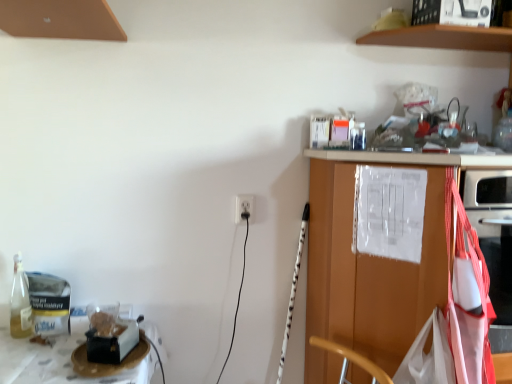
Question: Does wooden cabinet at right have a greater width compared to white plastic electric outlet at center?

Choices:
 (A) yes
 (B) no

Answer: (A)

Question: Can you confirm if wooden cabinet at right is shorter than white plastic electric outlet at center?

Choices:
 (A) yes
 (B) no

Answer: (B)

Question: Is wooden cabinet at right aimed at white plastic electric outlet at center?

Choices:
 (A) no
 (B) yes

Answer: (A)

Question: Can you confirm if wooden cabinet at right is smaller than white plastic electric outlet at center?

Choices:
 (A) yes
 (B) no

Answer: (B)

Question: Can you confirm if wooden cabinet at right is positioned to the left of white plastic electric outlet at center?

Choices:
 (A) no
 (B) yes

Answer: (A)

Question: Would you say wooden cabinet at right is inside or outside white plastic electric outlet at center?

Choices:
 (A) outside
 (B) inside

Answer: (A)

Question: Is wooden cabinet at right in front of or behind white plastic electric outlet at center in the image?

Choices:
 (A) behind
 (B) front

Answer: (B)

Question: Does point (508, 157) appear closer or farther from the camera than point (242, 218)?

Choices:
 (A) closer
 (B) farther

Answer: (A)

Question: In terms of size, does wooden cabinet at right appear bigger or smaller than white plastic electric outlet at center?

Choices:
 (A) small
 (B) big

Answer: (B)

Question: From a real-world perspective, relative to white plastic electric outlet at center, is brown wooden shelf at upper center vertically above or below?

Choices:
 (A) below
 (B) above

Answer: (B)

Question: Is brown wooden shelf at upper center in front of or behind white plastic electric outlet at center in the image?

Choices:
 (A) behind
 (B) front

Answer: (B)

Question: Does point (424, 43) appear closer or farther from the camera than point (246, 208)?

Choices:
 (A) closer
 (B) farther

Answer: (A)

Question: Is brown wooden shelf at upper center situated inside white plastic electric outlet at center or outside?

Choices:
 (A) outside
 (B) inside

Answer: (A)

Question: Does point (248, 211) appear closer or farther from the camera than point (466, 31)?

Choices:
 (A) farther
 (B) closer

Answer: (A)

Question: In the image, is white plastic electric outlet at center on the left side or the right side of brown wooden shelf at upper center?

Choices:
 (A) left
 (B) right

Answer: (A)